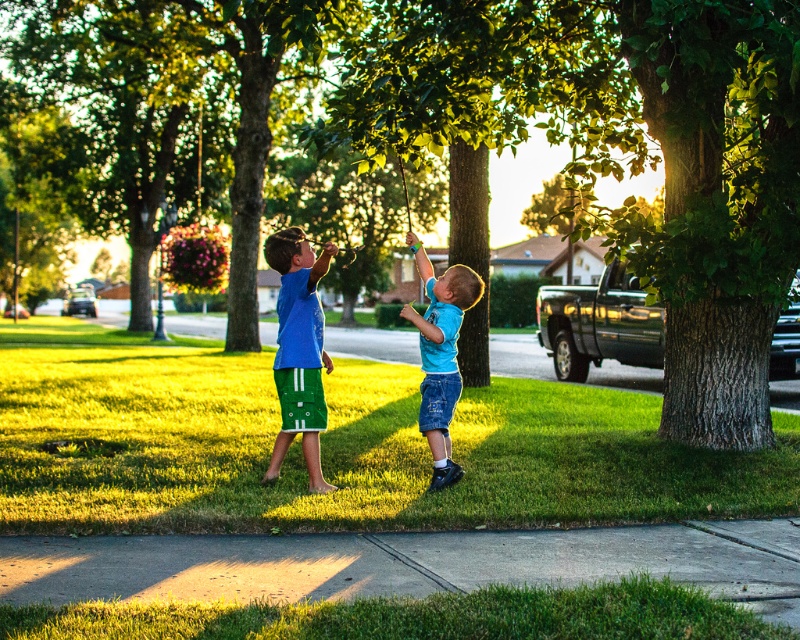
You are a photographer trying to capture a photo of the green leafy tree at center and the green fabric shorts at center. Since both are green, you want to ensure they are distinguishable in the photo. Which object should you focus on to make sure it stands out more due to its size?

The green leafy tree at center is shorter than green fabric shorts at center, so focusing on the green fabric shorts at center would make it stand out more due to its larger size compared to the tree.

You are a gardener planning to plant flowers in the garden. You have two areas to choose from in the image provided. Which area would you select for planting flowers, the green grass at center or the gray concrete pavement at lower center, and why?

The gardener should choose the green grass at center because it has a larger size compared to the gray concrete pavement at lower center, making it more suitable for planting flowers.